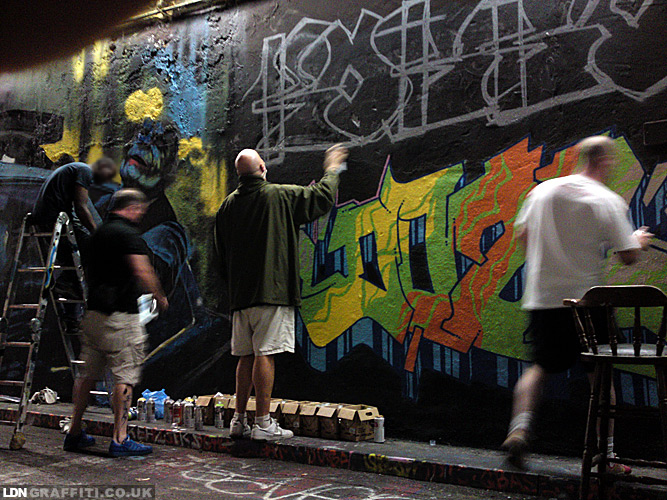
The height and width of the screenshot is (500, 667). Find the location of `ladder`. ladder is located at coordinates [47, 267].